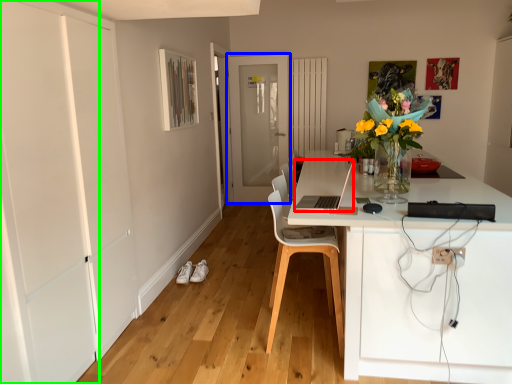
Question: Based on their relative distances, which object is farther from computer (highlighted by a red box)? Choose from door (highlighted by a blue box) and door (highlighted by a green box).

Choices:
 (A) door
 (B) door

Answer: (A)